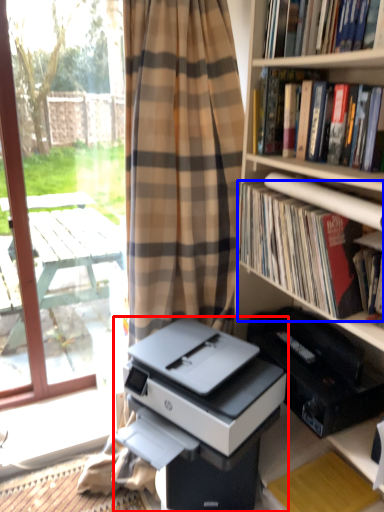
Question: Which of the following is the farthest to the observer, printer (highlighted by a red box) or book (highlighted by a blue box)?

Choices:
 (A) printer
 (B) book

Answer: (B)